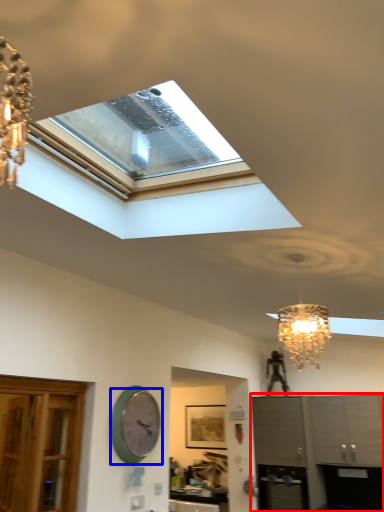
Question: Which object is closer to the camera taking this photo, cabinetry (highlighted by a red box) or wall clock (highlighted by a blue box)?

Choices:
 (A) cabinetry
 (B) wall clock

Answer: (B)